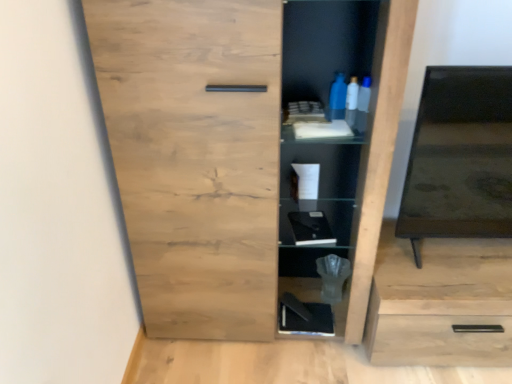
The height and width of the screenshot is (384, 512). In order to click on black glossy tv at right in this screenshot , I will do `click(460, 158)`.

Where is `light wood drawer at lower right`? This screenshot has height=384, width=512. light wood drawer at lower right is located at coordinates (440, 302).

In terms of size, does natural wood cupboard at center appear bigger or smaller than black matte book at lower center, the second cabinet when ordered from front to back?

Clearly, natural wood cupboard at center is larger in size than black matte book at lower center, the second cabinet when ordered from front to back.

Does natural wood cupboard at center turn towards black matte book at lower center, acting as the 2th cabinet starting from the top?

No, natural wood cupboard at center is not facing towards black matte book at lower center, acting as the 2th cabinet starting from the top.

Does natural wood cupboard at center touch black matte book at lower center, acting as the 2th cabinet starting from the top?

No, natural wood cupboard at center is not with black matte book at lower center, acting as the 2th cabinet starting from the top.

From the image's perspective, is natural wood cupboard at center below black matte book at lower center, arranged as the 1th cabinet when ordered from the bottom?

Incorrect, from the image's perspective, natural wood cupboard at center is higher than black matte book at lower center, arranged as the 1th cabinet when ordered from the bottom.

Considering the relative sizes of natural wood cupboard at center and black glossy tv at right in the image provided, is natural wood cupboard at center thinner than black glossy tv at right?

No, natural wood cupboard at center is not thinner than black glossy tv at right.

Who is smaller, natural wood cupboard at center or black glossy tv at right?

Smaller between the two is black glossy tv at right.

Is point (90, 32) closer or farther from the camera than point (424, 181)?

Point (90, 32) appears to be closer to the viewer than point (424, 181).

Considering the relative positions of natural wood cupboard at center and black glossy tv at right in the image provided, is natural wood cupboard at center to the left of black glossy tv at right from the viewer's perspective?

Yes.

Can you tell me how much black plastic scale at center, placed as the 2th cabinet when sorted from bottom to top, and light wood drawer at lower right differ in facing direction?

5.34 degrees.

Between black plastic scale at center, placed as the 2th cabinet when sorted from bottom to top, and light wood drawer at lower right, which one has smaller width?

black plastic scale at center, placed as the 2th cabinet when sorted from bottom to top.

Find the location of a particular element. The height and width of the screenshot is (384, 512). cabinetry below the black plastic scale at center, positioned as the 1th cabinet in top-to-bottom order (from a real-world perspective) is located at coordinates (440, 302).

Looking at the image, does black plastic scale at center, which ranks as the first cabinet in front-to-back order, seem bigger or smaller compared to light wood drawer at lower right?

black plastic scale at center, which ranks as the first cabinet in front-to-back order, is smaller than light wood drawer at lower right.

Considering the relative sizes of natural wood cupboard at center and black plastic scale at center, which ranks as the first cabinet in front-to-back order, in the image provided, is natural wood cupboard at center bigger than black plastic scale at center, which ranks as the first cabinet in front-to-back order,?

Indeed, natural wood cupboard at center has a larger size compared to black plastic scale at center, which ranks as the first cabinet in front-to-back order.

Is natural wood cupboard at center positioned behind black plastic scale at center, which ranks as the first cabinet in front-to-back order?

No, natural wood cupboard at center is in front of black plastic scale at center, which ranks as the first cabinet in front-to-back order.

Is black plastic scale at center, placed as the 2th cabinet when sorted from back to front, surrounded by natural wood cupboard at center?

Yes, black plastic scale at center, placed as the 2th cabinet when sorted from back to front, is surrounded by natural wood cupboard at center.

Between natural wood cupboard at center and black plastic scale at center, which ranks as the first cabinet in front-to-back order, which one has smaller width?

black plastic scale at center, which ranks as the first cabinet in front-to-back order, is thinner.

Is light wood drawer at lower right wider than natural wood cupboard at center?

Indeed, light wood drawer at lower right has a greater width compared to natural wood cupboard at center.

Is light wood drawer at lower right spatially inside natural wood cupboard at center, or outside of it?

light wood drawer at lower right lies outside natural wood cupboard at center.

From the image's perspective, is light wood drawer at lower right beneath natural wood cupboard at center?

Yes, from the image's perspective, light wood drawer at lower right is beneath natural wood cupboard at center.

Are light wood drawer at lower right and natural wood cupboard at center located far from each other?

light wood drawer at lower right is near natural wood cupboard at center, not far away.

Is black glossy tv at right looking in the opposite direction of natural wood cupboard at center?

black glossy tv at right does not have its back to natural wood cupboard at center.

Would you say black glossy tv at right is outside natural wood cupboard at center?

Absolutely, black glossy tv at right is external to natural wood cupboard at center.

Is black glossy tv at right in contact with natural wood cupboard at center?

No.

Could you tell me if light wood drawer at lower right is turned towards black matte book at lower center, arranged as the 1th cabinet when ordered from the bottom?

No.

Does light wood drawer at lower right have a greater height compared to black matte book at lower center, which ranks as the first cabinet in back-to-front order?

Yes.

How different are the orientations of light wood drawer at lower right and black matte book at lower center, the second cabinet when ordered from front to back, in degrees?

They differ by 3.99 degrees in their facing directions.

From the picture: Does light wood drawer at lower right have a greater width compared to black matte book at lower center, the second cabinet when ordered from front to back?

Correct, the width of light wood drawer at lower right exceeds that of black matte book at lower center, the second cabinet when ordered from front to back.

I want to click on the 2nd cabinet below the natural wood cupboard at center (from a real-world perspective), so click(x=301, y=288).

Locate an element on the screen. Image resolution: width=512 pixels, height=384 pixels. cupboard below the black glossy tv at right (from the image's perspective) is located at coordinates (241, 147).

Based on their spatial positions, is black glossy tv at right or black matte book at lower center, arranged as the 1th cabinet when ordered from the bottom, further from natural wood cupboard at center?

black matte book at lower center, arranged as the 1th cabinet when ordered from the bottom, lies further to natural wood cupboard at center than the other object.

Based on their spatial positions, is black plastic scale at center, positioned as the 1th cabinet in top-to-bottom order, or black matte book at lower center, arranged as the 1th cabinet when ordered from the bottom, closer to natural wood cupboard at center?

Among the two, black plastic scale at center, positioned as the 1th cabinet in top-to-bottom order, is located nearer to natural wood cupboard at center.

Considering their positions, is light wood drawer at lower right positioned closer to natural wood cupboard at center than black matte book at lower center, which ranks as the first cabinet in back-to-front order?

Among the two, light wood drawer at lower right is located nearer to natural wood cupboard at center.

Which object lies further to the anchor point light wood drawer at lower right, black matte book at lower center, the second cabinet when ordered from front to back, or natural wood cupboard at center?

Among the two, natural wood cupboard at center is located further to light wood drawer at lower right.

Estimate the real-world distances between objects in this image. Which object is further from black matte book at lower center, acting as the 2th cabinet starting from the top, natural wood cupboard at center or black plastic scale at center, placed as the 2th cabinet when sorted from back to front?

natural wood cupboard at center.

From the image, which object appears to be nearer to light wood drawer at lower right, black glossy tv at right or natural wood cupboard at center?

black glossy tv at right lies closer to light wood drawer at lower right than the other object.

Estimate the real-world distances between objects in this image. Which object is further from black glossy tv at right, black plastic scale at center, placed as the 2th cabinet when sorted from back to front, or light wood drawer at lower right?

Based on the image, black plastic scale at center, placed as the 2th cabinet when sorted from back to front, appears to be further to black glossy tv at right.

Considering their positions, is light wood drawer at lower right positioned further to black plastic scale at center, positioned as the 1th cabinet in top-to-bottom order, than black matte book at lower center, which ranks as the first cabinet in back-to-front order?

Based on the image, light wood drawer at lower right appears to be further to black plastic scale at center, positioned as the 1th cabinet in top-to-bottom order.

The image size is (512, 384). In order to click on cabinet between natural wood cupboard at center and black matte book at lower center, acting as the 2th cabinet starting from the top, from front to back in this screenshot , I will do `click(338, 217)`.

Find the location of a particular element. This screenshot has width=512, height=384. cabinet between black plastic scale at center, placed as the 2th cabinet when sorted from back to front, and black glossy tv at right from left to right is located at coordinates (301, 288).

At what (x,y) coordinates should I click in order to perform the action: click on medicine cabinet between black matte book at lower center, which ranks as the first cabinet in back-to-front order, and light wood drawer at lower right from left to right. Please return your answer as a coordinate pair (x, y). This screenshot has width=512, height=384. Looking at the image, I should click on (460, 158).

I want to click on medicine cabinet between black plastic scale at center, placed as the 2th cabinet when sorted from bottom to top, and light wood drawer at lower right, in the horizontal direction, so click(x=460, y=158).